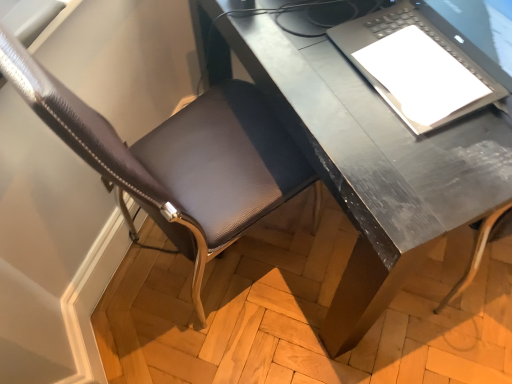
Question: Would you say metallic gray desk at center contains leather-like brown chair at lower left?

Choices:
 (A) no
 (B) yes

Answer: (A)

Question: Is metallic gray desk at center positioned with its back to leather-like brown chair at lower left?

Choices:
 (A) yes
 (B) no

Answer: (B)

Question: Does metallic gray desk at center have a greater height compared to leather-like brown chair at lower left?

Choices:
 (A) yes
 (B) no

Answer: (B)

Question: Is metallic gray desk at center not inside leather-like brown chair at lower left?

Choices:
 (A) no
 (B) yes

Answer: (B)

Question: Does metallic gray desk at center have a smaller size compared to leather-like brown chair at lower left?

Choices:
 (A) yes
 (B) no

Answer: (B)

Question: Does metallic gray desk at center come in front of leather-like brown chair at lower left?

Choices:
 (A) yes
 (B) no

Answer: (B)

Question: From the image's perspective, is leather-like brown chair at lower left located beneath matte black laptop at upper right?

Choices:
 (A) no
 (B) yes

Answer: (B)

Question: From the image's perspective, is leather-like brown chair at lower left on top of matte black laptop at upper right?

Choices:
 (A) no
 (B) yes

Answer: (A)

Question: Is leather-like brown chair at lower left smaller than matte black laptop at upper right?

Choices:
 (A) yes
 (B) no

Answer: (B)

Question: Is leather-like brown chair at lower left closer to the viewer compared to matte black laptop at upper right?

Choices:
 (A) yes
 (B) no

Answer: (A)

Question: Would you say leather-like brown chair at lower left contains matte black laptop at upper right?

Choices:
 (A) yes
 (B) no

Answer: (B)

Question: Is leather-like brown chair at lower left next to matte black laptop at upper right and touching it?

Choices:
 (A) yes
 (B) no

Answer: (B)

Question: Is matte black laptop at upper right facing away from metallic gray desk at center?

Choices:
 (A) yes
 (B) no

Answer: (B)